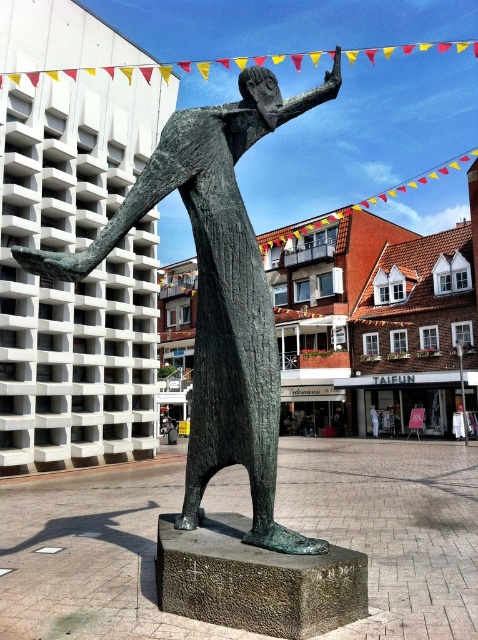
Is bronze statue at center below blue fabric person at center?

Incorrect, bronze statue at center is not positioned below blue fabric person at center.

Can you confirm if bronze statue at center is smaller than blue fabric person at center?

Actually, bronze statue at center might be larger than blue fabric person at center.

Locate an element on the screen. Image resolution: width=478 pixels, height=640 pixels. bronze statue at center is located at coordinates (217, 291).